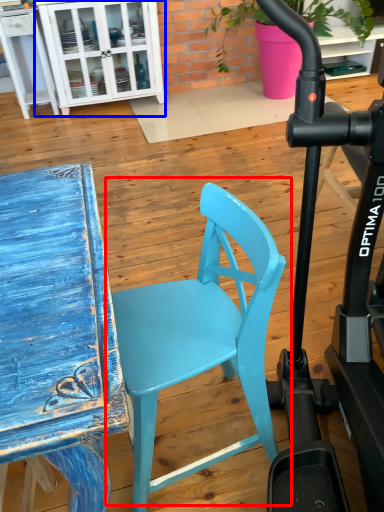
Question: Among these objects, which one is farthest to the camera, chair (highlighted by a red box) or cabinetry (highlighted by a blue box)?

Choices:
 (A) chair
 (B) cabinetry

Answer: (B)